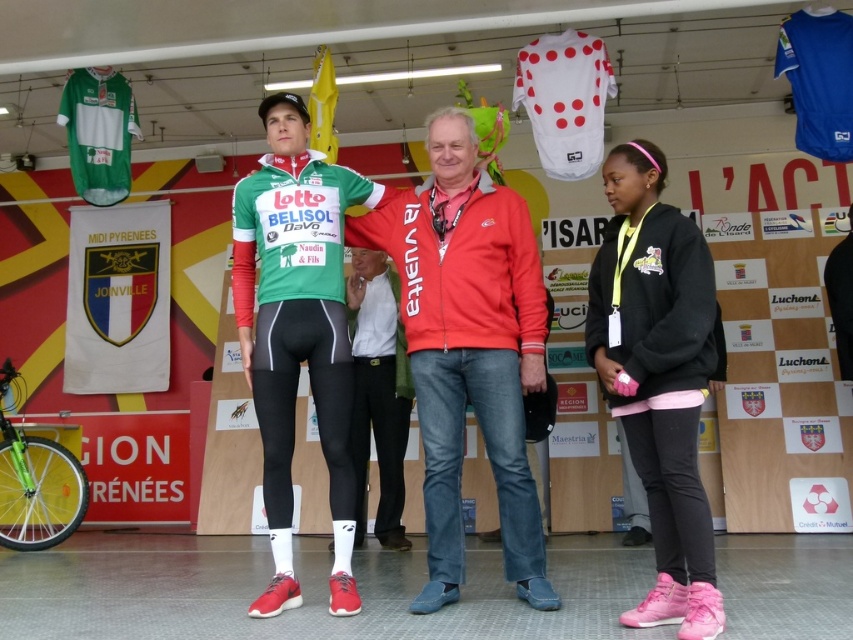
Is point (474, 394) more distant than point (685, 554)?

Yes.

Does red fabric jacket at center have a greater height compared to black fleece jacket at lower right?

Yes, red fabric jacket at center is taller than black fleece jacket at lower right.

Between point (489, 221) and point (646, 221), which one is positioned behind?

The point (489, 221) is more distant.

You are a GUI agent. You are given a task and a screenshot of the screen. Output one action in this format:
    pyautogui.click(x=<x>, y=<y>)
    Task: Click on the red fabric jacket at center
    This screenshot has height=640, width=853.
    Given the screenshot: What is the action you would take?
    coord(468,348)